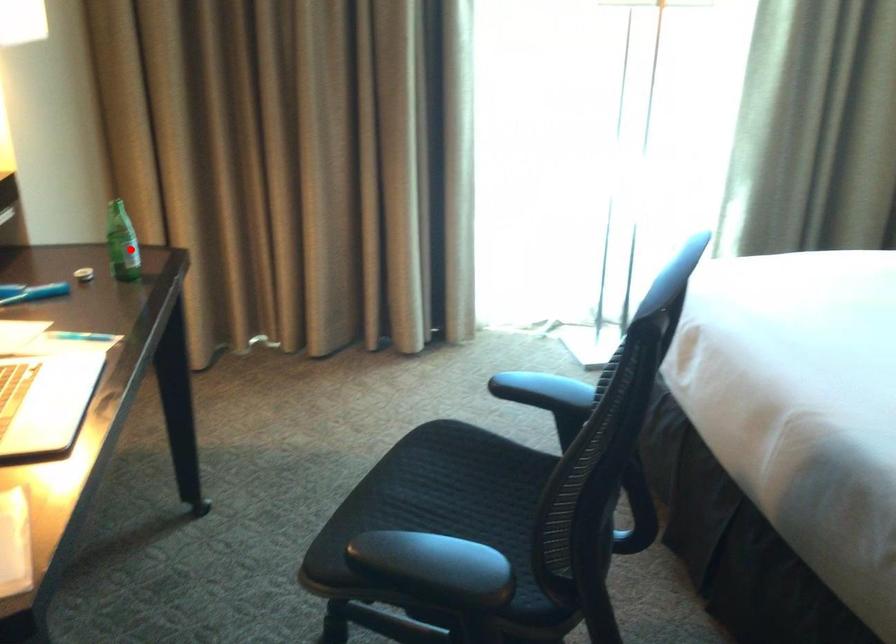
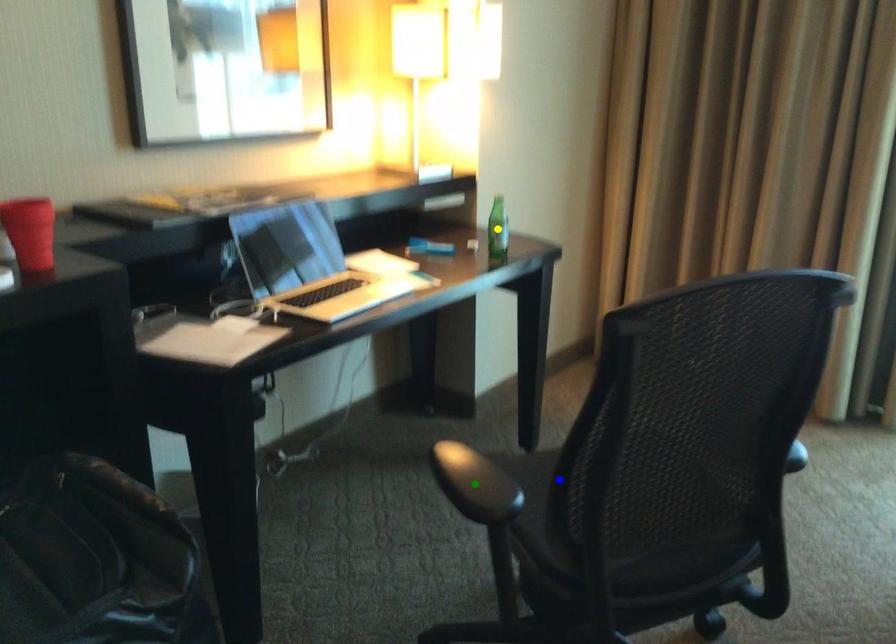
Question: I am providing you with two images of the same scene from different viewpoints. A red point is marked on the first image. You are given multiple points on the second image. Which point in image 2 is actually the same real-world point as the red point in image 1?

Choices:
 (A) blue point
 (B) green point
 (C) yellow point

Answer: (C)